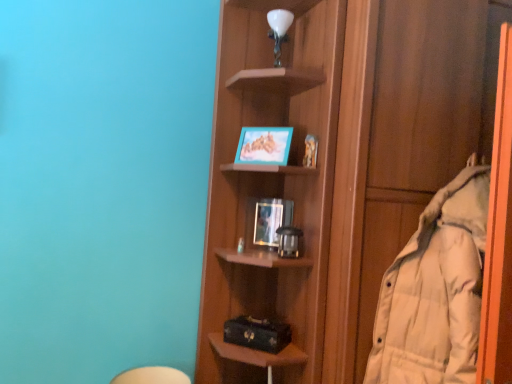
Question: Is the position of white down-filled coat at right less distant than that of wooden shelf at center?

Choices:
 (A) yes
 (B) no

Answer: (A)

Question: Is wooden shelf at center a part of white down-filled coat at right?

Choices:
 (A) no
 (B) yes

Answer: (A)

Question: Is white down-filled coat at right bigger than wooden shelf at center?

Choices:
 (A) yes
 (B) no

Answer: (B)

Question: Is the position of white down-filled coat at right more distant than that of wooden shelf at center?

Choices:
 (A) yes
 (B) no

Answer: (B)

Question: Is white down-filled coat at right at the right side of wooden shelf at center?

Choices:
 (A) no
 (B) yes

Answer: (A)

Question: Considering the relative sizes of white down-filled coat at right and wooden shelf at center in the image provided, is white down-filled coat at right shorter than wooden shelf at center?

Choices:
 (A) no
 (B) yes

Answer: (B)

Question: Is wooden shelf at center surrounding white down-filled coat at right?

Choices:
 (A) yes
 (B) no

Answer: (B)

Question: From the image's perspective, is wooden shelf at center on top of white down-filled coat at right?

Choices:
 (A) no
 (B) yes

Answer: (B)

Question: Does wooden shelf at center appear on the right side of white down-filled coat at right?

Choices:
 (A) no
 (B) yes

Answer: (B)

Question: Is wooden shelf at center at the left side of white down-filled coat at right?

Choices:
 (A) no
 (B) yes

Answer: (A)

Question: Is wooden shelf at center far away from white down-filled coat at right?

Choices:
 (A) yes
 (B) no

Answer: (B)

Question: Is wooden shelf at center touching white down-filled coat at right?

Choices:
 (A) yes
 (B) no

Answer: (B)

Question: Is white down-filled coat at right at the back of matte plastic picture frame at middle, the 2th picture frame from the top?

Choices:
 (A) no
 (B) yes

Answer: (A)